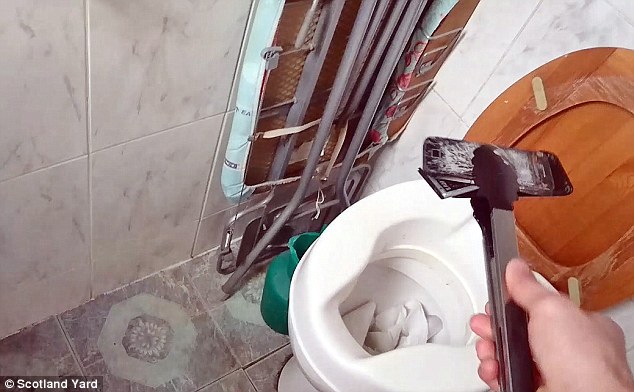
I want to click on floor, so click(178, 310).